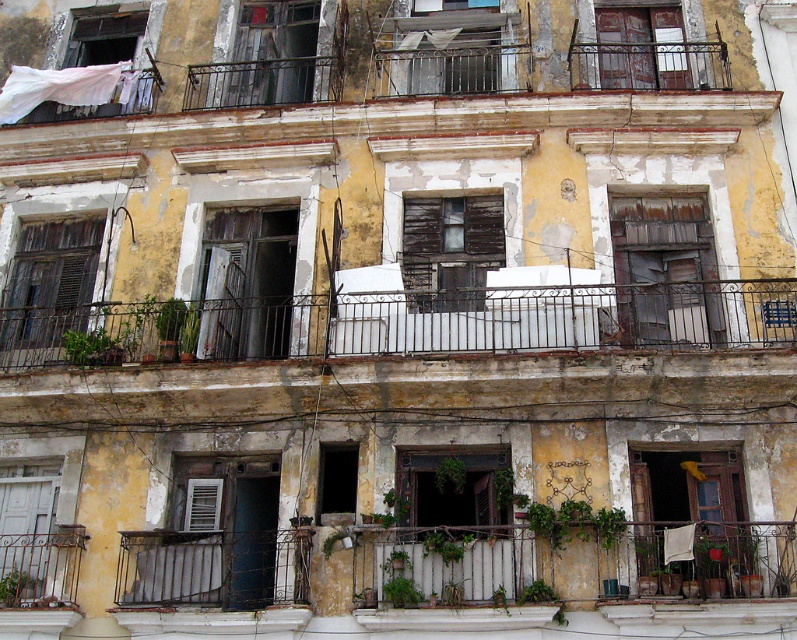
Which is in front, point (230, 257) or point (418, 461)?

Point (418, 461) is in front.

What do you see at coordinates (246, 282) in the screenshot? I see `wooden door at center` at bounding box center [246, 282].

This screenshot has width=797, height=640. What are the coordinates of `wooden door at center` in the screenshot? It's located at (246, 282).

Who is more forward, (458, 282) or (173, 550)?

Positioned in front is point (173, 550).

How far apart are wooden/weathered at center and metallic gray curtain at lower center?

They are 37.99 feet apart.

Which is in front, point (423, 209) or point (152, 593)?

Positioned in front is point (152, 593).

The width and height of the screenshot is (797, 640). I want to click on wooden/weathered at center, so click(450, 250).

Is point (218, 248) farther from camera compared to point (464, 13)?

No, (218, 248) is in front of (464, 13).

Between wooden door at center and rusty metal window at upper center, which one has less height?

Standing shorter between the two is wooden door at center.

Between point (281, 308) and point (464, 17), which one is positioned behind?

The point (464, 17) is more distant.

Identify the location of wooden door at center. The height and width of the screenshot is (640, 797). (246, 282).